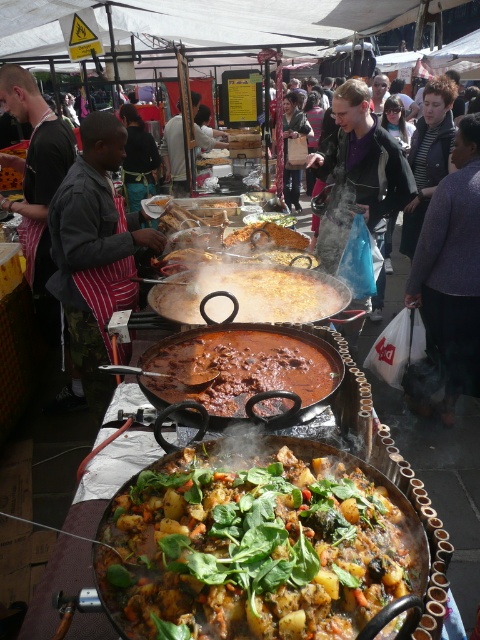
Question: Can you confirm if brown matte pan at center is bigger than brown matte paella pan at center?

Choices:
 (A) no
 (B) yes

Answer: (B)

Question: In this image, where is striped apron at left located relative to brown matte stew at center?

Choices:
 (A) below
 (B) above

Answer: (B)

Question: Which of the following is the farthest from the observer?

Choices:
 (A) (238, 394)
 (B) (182, 156)
 (C) (268, 291)

Answer: (B)

Question: Which of the following is the farthest from the observer?

Choices:
 (A) (462, 193)
 (B) (268, 224)
 (C) (284, 310)

Answer: (B)

Question: Does purple sweater at center appear on the left side of white fabric apron at center?

Choices:
 (A) yes
 (B) no

Answer: (B)

Question: Which object is farther from the camera taking this photo?

Choices:
 (A) purple sweater at center
 (B) brown matte pan at center
 (C) striped apron at left

Answer: (A)